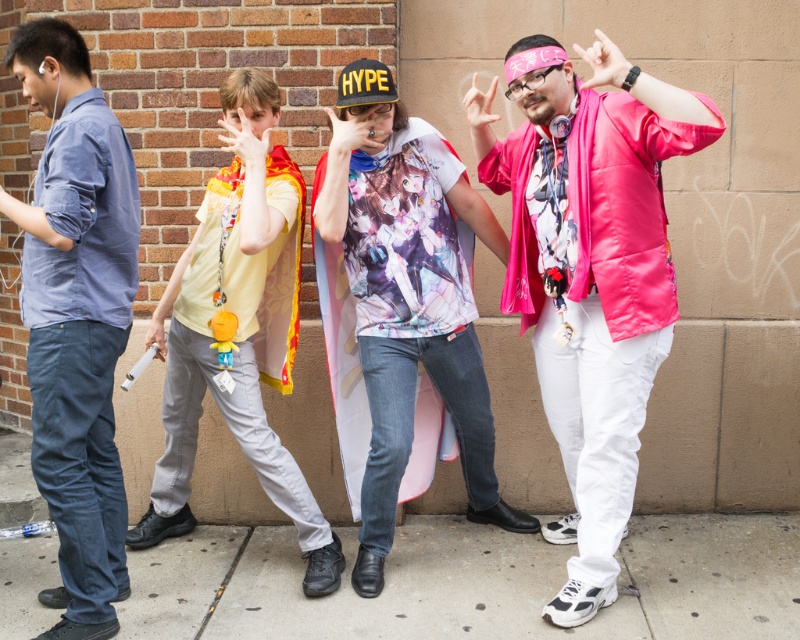
Is shiny pink jacket at center to the right of printed fabric shirt at center from the viewer's perspective?

Indeed, shiny pink jacket at center is positioned on the right side of printed fabric shirt at center.

Who is positioned more to the left, shiny pink jacket at center or printed fabric shirt at center?

From the viewer's perspective, printed fabric shirt at center appears more on the left side.

Does point (528, 289) lie behind point (425, 237)?

That is True.

This screenshot has height=640, width=800. Find the location of `shiny pink jacket at center`. shiny pink jacket at center is located at coordinates (x=590, y=269).

Between concrete at lower center and yellow fabric scarf at center, which one is positioned higher?

Positioned higher is yellow fabric scarf at center.

Can you confirm if concrete at lower center is bigger than yellow fabric scarf at center?

Incorrect, concrete at lower center is not larger than yellow fabric scarf at center.

Where is `concrete at lower center`? The width and height of the screenshot is (800, 640). concrete at lower center is located at coordinates (472, 582).

Is point (348, 556) closer to viewer compared to point (58, 157)?

No, it is not.

Between concrete at lower center and blue denim jeans at left, which one appears on the right side from the viewer's perspective?

concrete at lower center is more to the right.

Who is more forward, (176, 563) or (73, 225)?

Positioned in front is point (73, 225).

Find the location of a particular element. Image resolution: width=800 pixels, height=640 pixels. concrete at lower center is located at coordinates (472, 582).